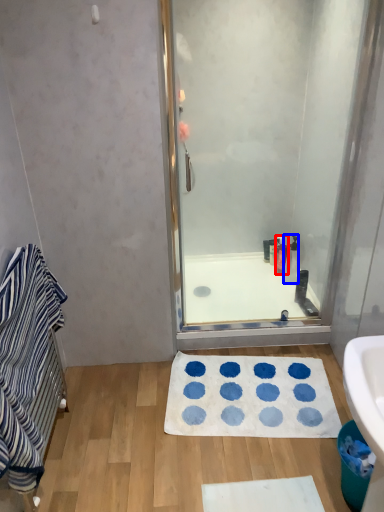
Question: Which object appears farthest to the camera in this image, toiletry (highlighted by a red box) or toiletry (highlighted by a blue box)?

Choices:
 (A) toiletry
 (B) toiletry

Answer: (A)